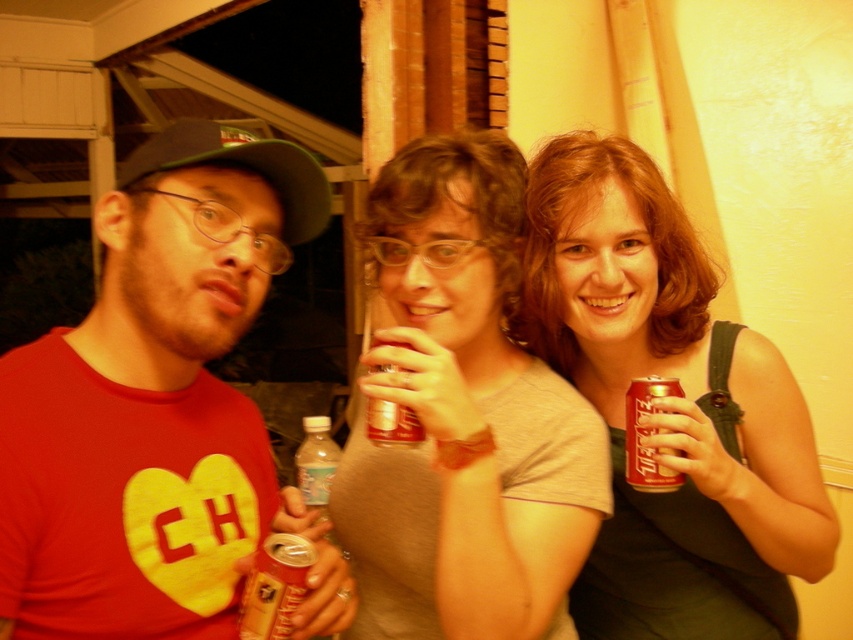
Question: Is shiny red can at center below matte plastic soda can at center?

Choices:
 (A) yes
 (B) no

Answer: (A)

Question: Estimate the real-world distances between objects in this image. Which object is farther from the translucent plastic water bottle at center?

Choices:
 (A) matte red t-shirt at left
 (B) metallic silver can at center
 (C) matte plastic soda can at center
 (D) shiny red can at center

Answer: (D)

Question: Can you confirm if matte red t-shirt at left is smaller than shiny red can at center?

Choices:
 (A) no
 (B) yes

Answer: (B)

Question: Where is metallic gold can at center located in relation to matte plastic soda can at center in the image?

Choices:
 (A) above
 (B) below

Answer: (B)

Question: Which of the following is the closest to the observer?

Choices:
 (A) (677, 486)
 (B) (407, 419)
 (C) (456, 304)

Answer: (B)

Question: Among these points, which one is nearest to the camera?

Choices:
 (A) (628, 404)
 (B) (302, 576)

Answer: (B)